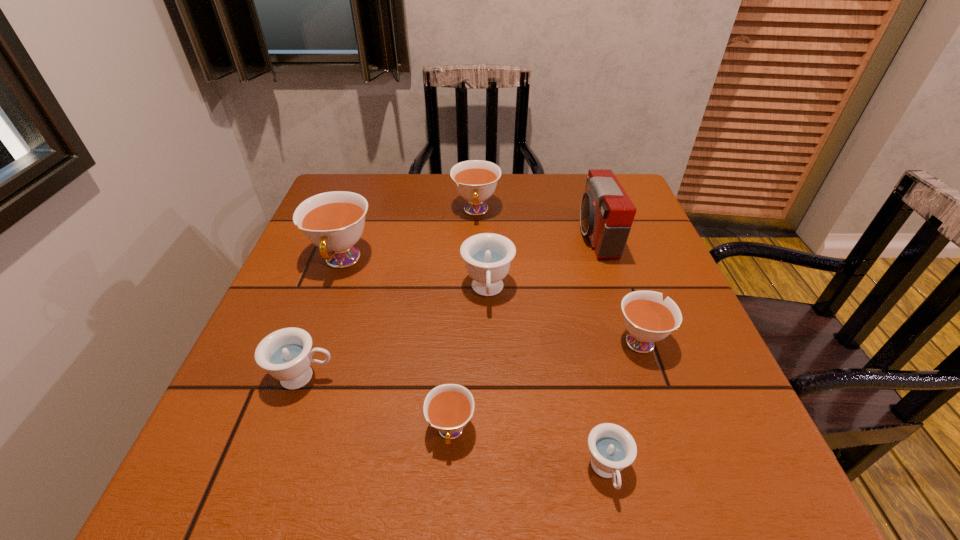
Locate an element on the screen. Image resolution: width=960 pixels, height=540 pixels. free space at the near edge is located at coordinates (392, 464).

Image resolution: width=960 pixels, height=540 pixels. I want to click on vacant space at the left edge of the desktop, so point(279,327).

This screenshot has height=540, width=960. I want to click on vacant area at the right edge, so point(671,289).

Locate an element on the screen. Image resolution: width=960 pixels, height=540 pixels. blank space at the near left corner is located at coordinates (277, 496).

You are a GUI agent. You are given a task and a screenshot of the screen. Output one action in this format:
    pyautogui.click(x=<x>, y=<y>)
    Task: Click on the free space that is in between the second blue teacup from left to right and the sixth object from left to right
    Image resolution: width=960 pixels, height=540 pixels.
    Given the screenshot: What is the action you would take?
    click(x=547, y=381)

This screenshot has height=540, width=960. In order to click on free space between the third object from right to left and the second farthest white teacup in this screenshot , I will do `click(474, 366)`.

Locate an element on the screen. unoccupied position between the camera and the farthest white teacup is located at coordinates (536, 223).

At what (x,y) coordinates should I click in order to perform the action: click on free spot between the farthest teacup and the camera. Please return your answer as a coordinate pair (x, y). This screenshot has height=540, width=960. Looking at the image, I should click on (536, 223).

Where is `free space between the biggest blue teacup and the camera`? The width and height of the screenshot is (960, 540). free space between the biggest blue teacup and the camera is located at coordinates (541, 263).

Identify the location of free area in between the farthest white teacup and the nearest white teacup. The width and height of the screenshot is (960, 540). (464, 321).